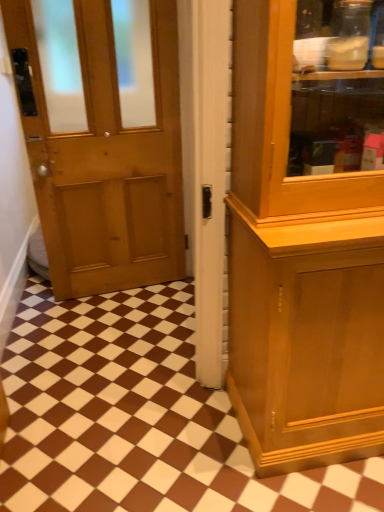
Question: Is matte wood door at center bigger or smaller than brown glossy tile at center?

Choices:
 (A) big
 (B) small

Answer: (B)

Question: In the image, is matte wood door at center positioned in front of or behind brown glossy tile at center?

Choices:
 (A) behind
 (B) front

Answer: (B)

Question: Is matte wood door at center wider or thinner than brown glossy tile at center?

Choices:
 (A) thin
 (B) wide

Answer: (A)

Question: Is brown glossy tile at center taller or shorter than matte wood door at center?

Choices:
 (A) tall
 (B) short

Answer: (B)

Question: Considering the positions of brown glossy tile at center and matte wood door at center in the image, is brown glossy tile at center wider or thinner than matte wood door at center?

Choices:
 (A) thin
 (B) wide

Answer: (B)

Question: In the image, is brown glossy tile at center positioned in front of or behind matte wood door at center?

Choices:
 (A) front
 (B) behind

Answer: (B)

Question: Would you say brown glossy tile at center is inside or outside matte wood door at center?

Choices:
 (A) inside
 (B) outside

Answer: (B)